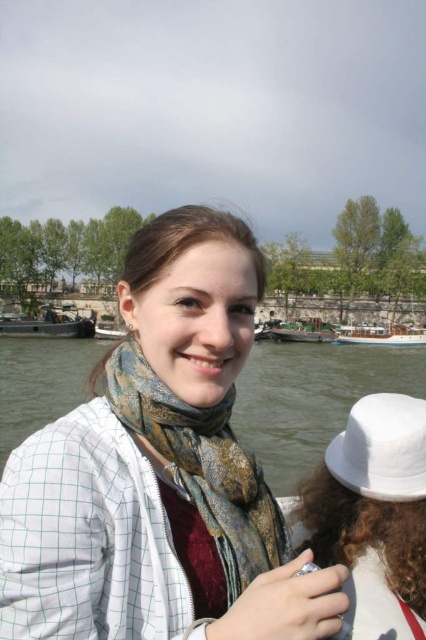
You are a photographer trying to capture the best shot of the two subjects in the image. The subjects are wearing a white checkered shirt at center and a printed silk scarf at center. Which clothing item is positioned higher on the person?

The white checkered shirt at center is located above the printed silk scarf at center, so the white checkered shirt at center is positioned higher on the person.